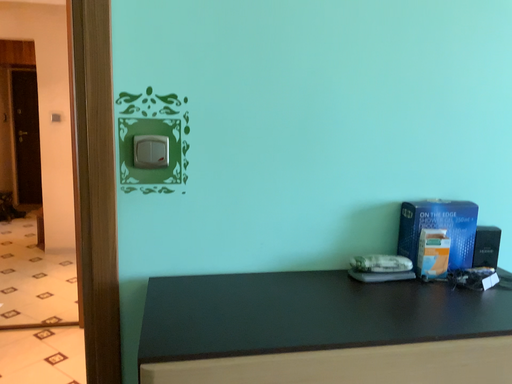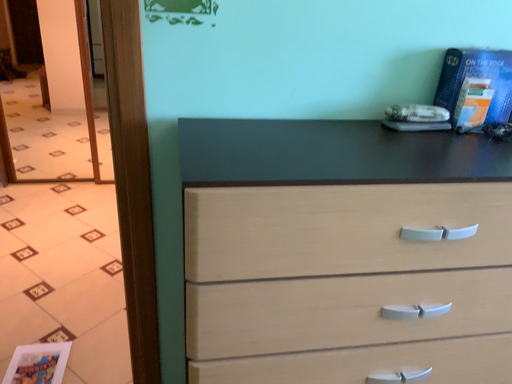
Question: How did the camera likely rotate when shooting the video?

Choices:
 (A) rotated downward
 (B) rotated upward

Answer: (A)